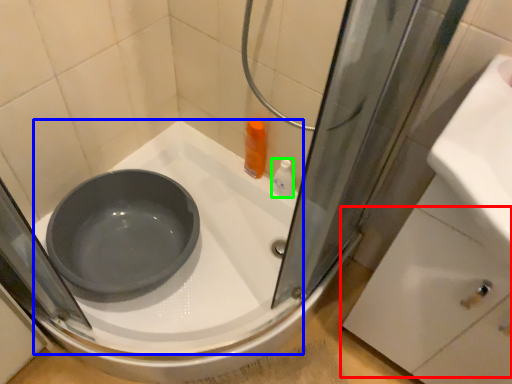
Question: Estimate the real-world distances between objects in this image. Which object is farther from drawer (highlighted by a red box), bath (highlighted by a blue box) or toiletry (highlighted by a green box)?

Choices:
 (A) bath
 (B) toiletry

Answer: (B)